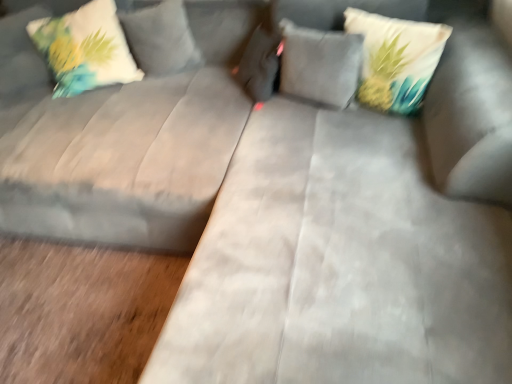
Question: Is suede gray couch at center at the right side of white fabric pillow with floral design at upper left, the 1th pillow positioned from the left?

Choices:
 (A) yes
 (B) no

Answer: (A)

Question: Could you tell me if suede gray couch at center is turned towards white fabric pillow with floral design at upper left, the 1th pillow positioned from the left?

Choices:
 (A) yes
 (B) no

Answer: (B)

Question: Is suede gray couch at center shorter than white fabric pillow with floral design at upper left, positioned as the third pillow in right-to-left order?

Choices:
 (A) no
 (B) yes

Answer: (A)

Question: Is suede gray couch at center positioned far away from white fabric pillow with floral design at upper left, the 1th pillow positioned from the left?

Choices:
 (A) yes
 (B) no

Answer: (B)

Question: Is suede gray couch at center facing away from white fabric pillow with floral design at upper left, positioned as the third pillow in right-to-left order?

Choices:
 (A) no
 (B) yes

Answer: (A)

Question: From their relative heights in the image, would you say suede gray couch at center is taller or shorter than printed fabric pillow at upper right, the third pillow in the left-to-right sequence?

Choices:
 (A) short
 (B) tall

Answer: (B)

Question: Is point (78, 152) closer or farther from the camera than point (433, 29)?

Choices:
 (A) closer
 (B) farther

Answer: (B)

Question: From the image's perspective, is suede gray couch at center above or below printed fabric pillow at upper right, which is the 1th pillow in right-to-left order?

Choices:
 (A) below
 (B) above

Answer: (A)

Question: Considering the positions of suede gray couch at center and printed fabric pillow at upper right, which is the 1th pillow in right-to-left order, in the image, is suede gray couch at center bigger or smaller than printed fabric pillow at upper right, which is the 1th pillow in right-to-left order,?

Choices:
 (A) small
 (B) big

Answer: (B)

Question: Is suede gray couch at center bigger or smaller than white fabric pillow with floral design at upper left, positioned as the third pillow in right-to-left order?

Choices:
 (A) small
 (B) big

Answer: (B)

Question: Does point tap(53, 160) appear closer or farther from the camera than point tap(100, 21)?

Choices:
 (A) farther
 (B) closer

Answer: (B)

Question: From the image's perspective, relative to white fabric pillow with floral design at upper left, the 1th pillow positioned from the left, is suede gray couch at center above or below?

Choices:
 (A) below
 (B) above

Answer: (A)

Question: Visually, is suede gray couch at center positioned to the left or to the right of white fabric pillow with floral design at upper left, the 1th pillow positioned from the left?

Choices:
 (A) left
 (B) right

Answer: (B)

Question: Is white fabric pillow with floral design at upper left, positioned as the third pillow in right-to-left order, wider or thinner than suede gray couch at center?

Choices:
 (A) wide
 (B) thin

Answer: (B)

Question: From the image's perspective, is white fabric pillow with floral design at upper left, the 1th pillow positioned from the left, located above or below suede gray couch at center?

Choices:
 (A) above
 (B) below

Answer: (A)